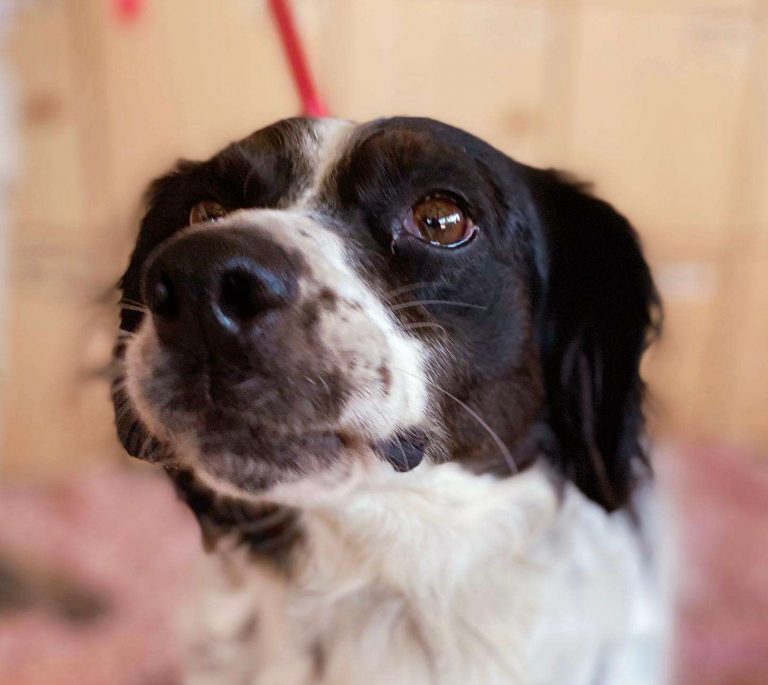
The width and height of the screenshot is (768, 685). Find the location of `pink rug`. pink rug is located at coordinates (70, 577), (68, 532).